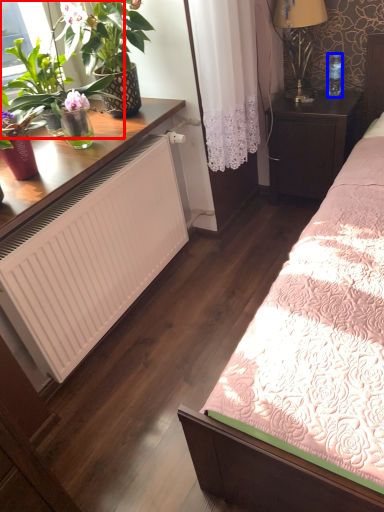
Question: Which object is closer to the camera taking this photo, houseplant (highlighted by a red box) or bottle (highlighted by a blue box)?

Choices:
 (A) houseplant
 (B) bottle

Answer: (A)